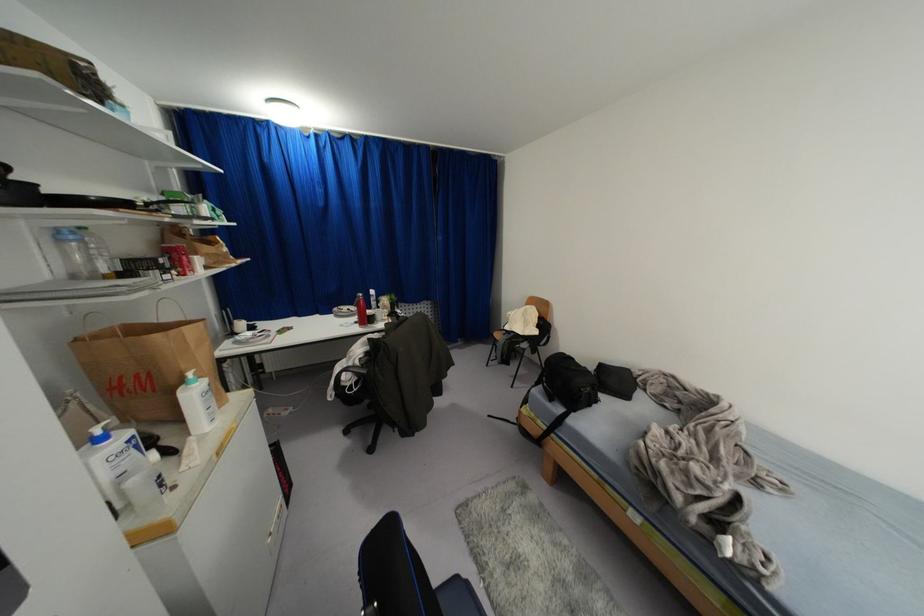
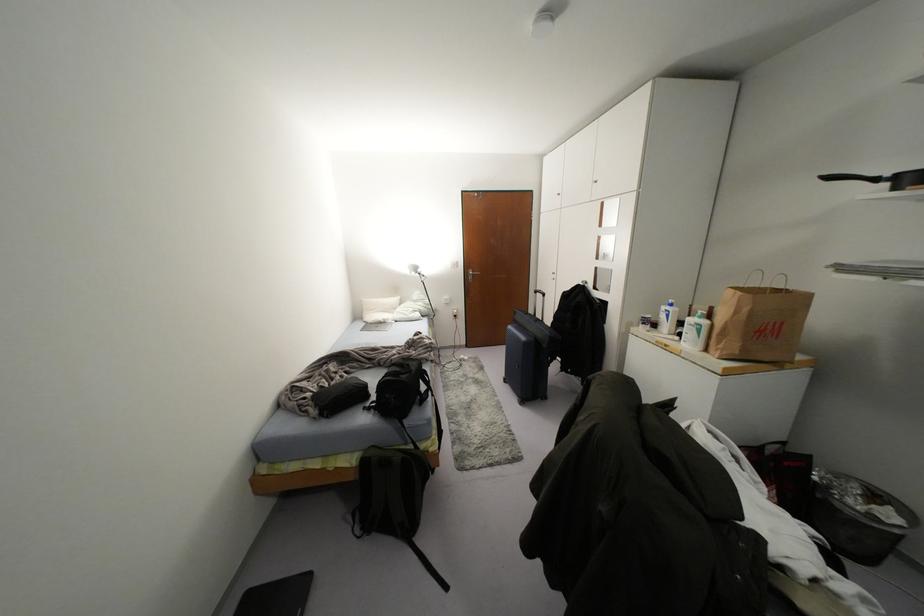
Where in the second image is the point corresponding to point (137, 446) from the first image?

(666, 315)